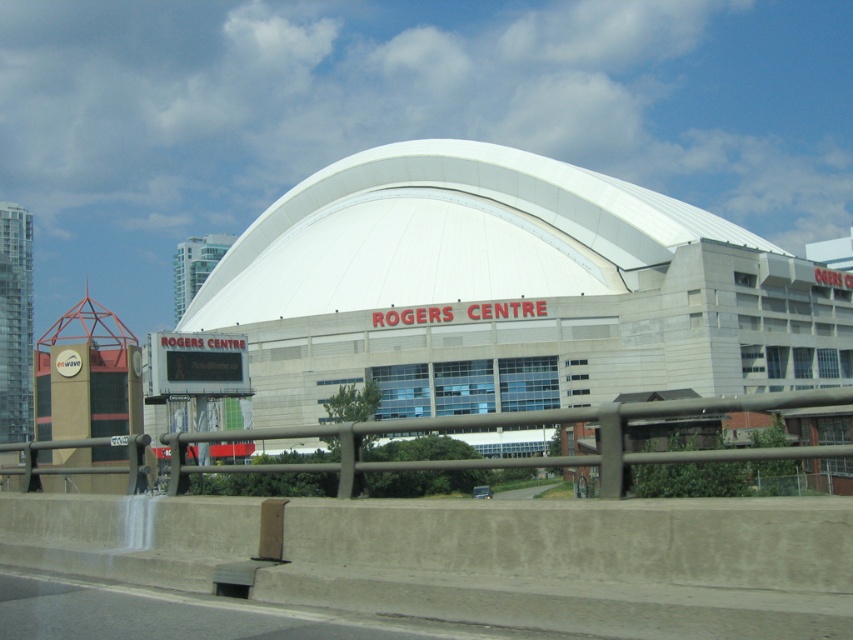
Is matte brown building at center wider than brown metal/rail at lower center?

Indeed, matte brown building at center has a greater width compared to brown metal/rail at lower center.

Who is more forward, (744, 339) or (569, 461)?

Point (569, 461)

Identify the location of matte brown building at center. The width and height of the screenshot is (853, 640). (511, 291).

Based on the photo, which is below, white smooth dome at center or brown metal/rail at lower center?

Positioned lower is brown metal/rail at lower center.

Is point (380, 177) positioned behind point (521, 465)?

Yes.

This screenshot has height=640, width=853. I want to click on white smooth dome at center, so click(x=448, y=234).

Is point (637, 330) positioned before point (550, 230)?

That is True.

Based on the photo, is matte brown building at center further to the viewer compared to white smooth dome at center?

That is False.

Is point (618, 305) positioned after point (279, 241)?

No, it is in front of (279, 241).

In order to click on matte brown building at center in this screenshot , I will do `click(511, 291)`.